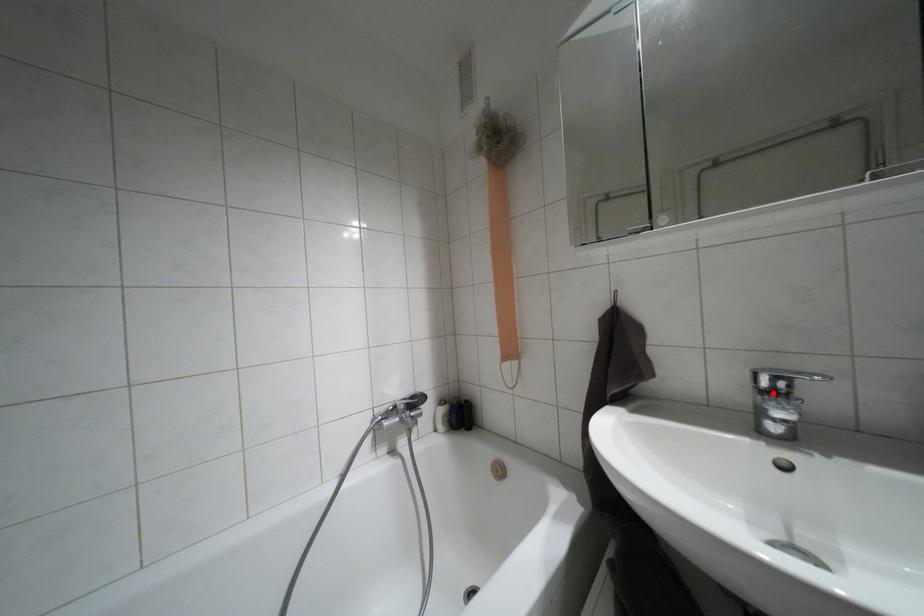
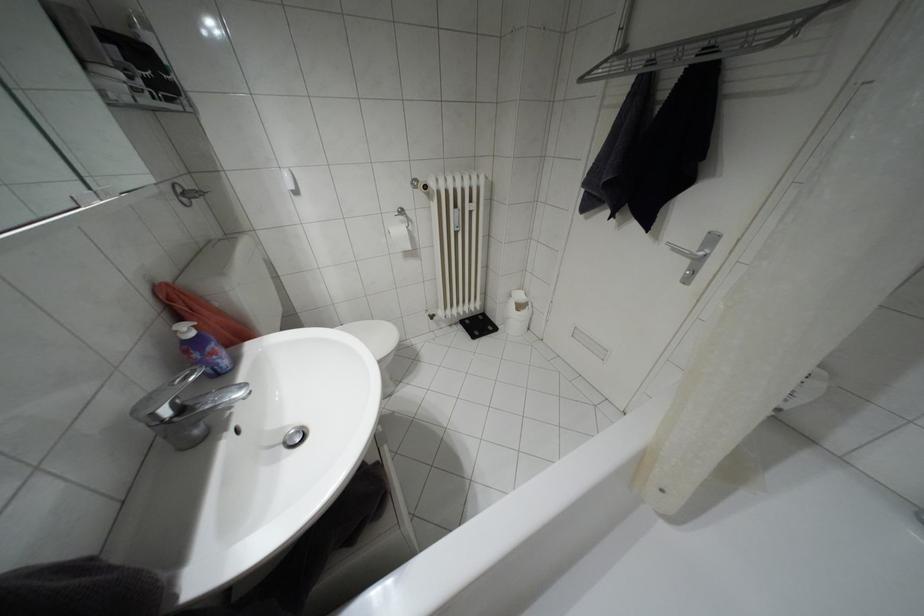
In the second image, find the point that corresponds to the highlighted location in the first image.

(180, 408)